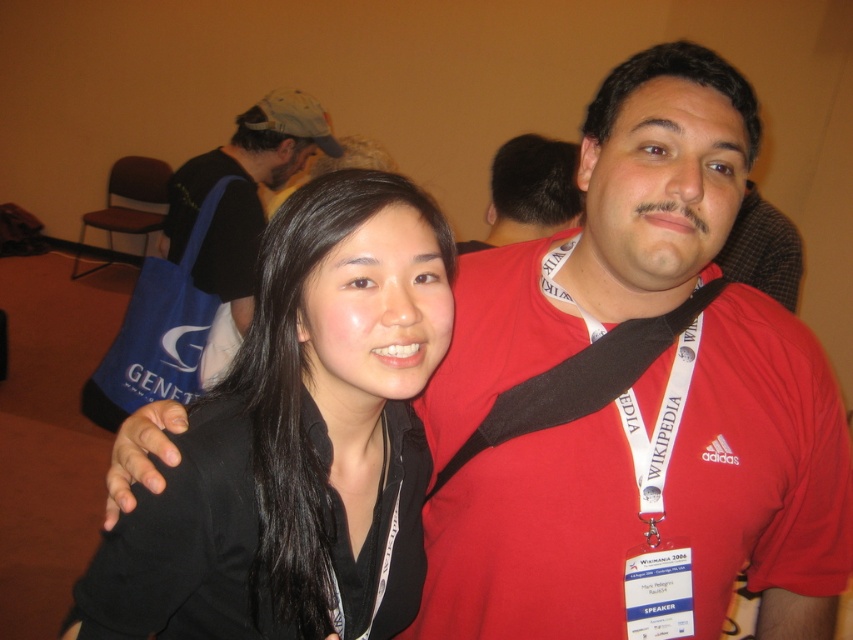
You are a photographer at a conference and want to capture a closeup of the black matte hair at center. The camera can only focus on objects within a 0.3 unit radius around the point specified. Is the black matte hair at center within the focus range of the camera at point [299,438]?

The black matte hair at center is exactly at point [299,438], so it will be in focus since it is within the 0.3 unit radius.